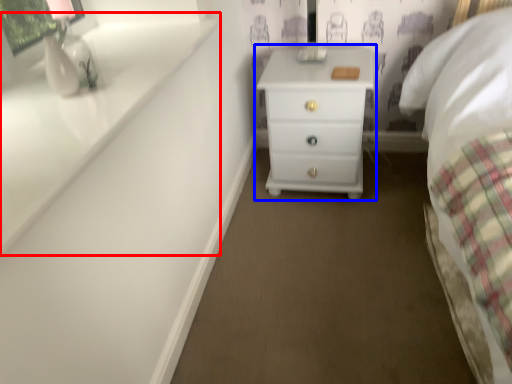
Question: Which object is closer to the camera taking this photo, window sill (highlighted by a red box) or chest of drawers (highlighted by a blue box)?

Choices:
 (A) window sill
 (B) chest of drawers

Answer: (A)